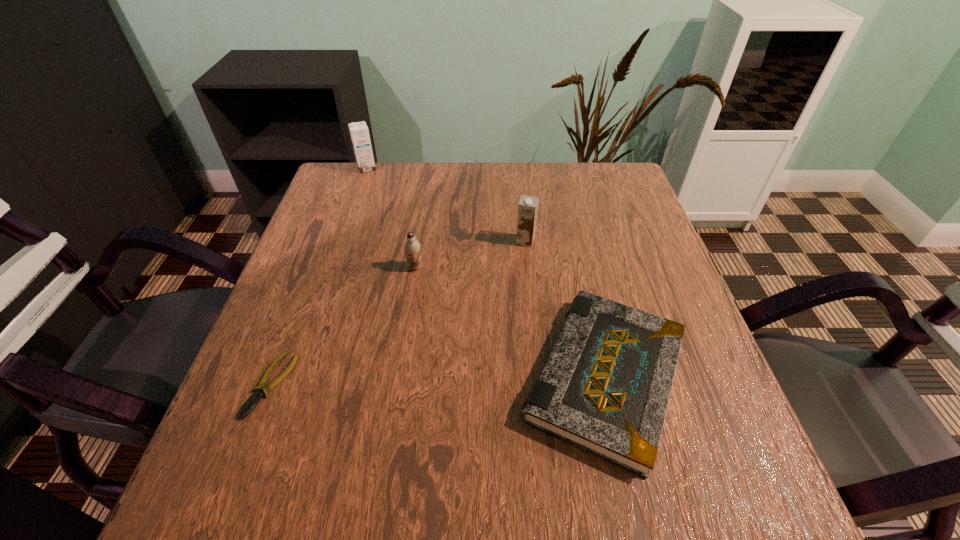
I want to click on vacant space located on the front of the third object from right to left, so click(x=393, y=417).

Where is `blank space located on the left of the second shortest object`? The height and width of the screenshot is (540, 960). blank space located on the left of the second shortest object is located at coordinates (325, 377).

The width and height of the screenshot is (960, 540). Find the location of `free location located on the front of the pliers`. free location located on the front of the pliers is located at coordinates (247, 449).

The height and width of the screenshot is (540, 960). Identify the location of object that is at the far edge. (359, 132).

Locate an element on the screen. The image size is (960, 540). object that is at the near edge is located at coordinates (605, 386).

At what (x,y) coordinates should I click in order to perform the action: click on chocolate milk that is at the left edge. Please return your answer as a coordinate pair (x, y). The height and width of the screenshot is (540, 960). Looking at the image, I should click on (359, 132).

Find the location of a particular element. pliers present at the left edge is located at coordinates (252, 402).

Find the location of a particular element. object present at the right edge is located at coordinates (605, 386).

Locate an element on the screen. object at the far left corner is located at coordinates (359, 132).

Find the location of a particular element. The image size is (960, 540). object present at the near right corner is located at coordinates (605, 386).